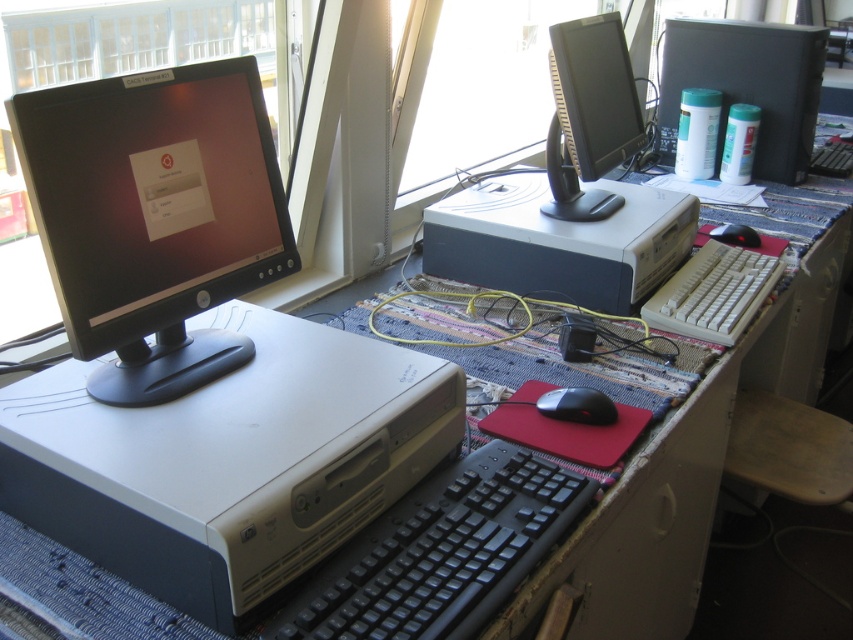
You are organizing cables on the desk and need to know the relative positions of the white plastic computer at upper right and the black rubber mouse at center. Which object is located higher up on the desk?

The white plastic computer at upper right is above the black rubber mouse at center, so it is located higher up on the desk.

You are organizing cables for the black glossy monitor at left located at point (154, 218). Is there enough space between the monitor and the edge of the desk to coil the cables neatly?

The black glossy monitor at left is located at point (154, 218). Since the desk has a patterned surface with blue, white, and red tones, there should be sufficient space between the monitor and the desk edge to coil the cables neatly.

You are a technician who needs to reach the white plastic computer at upper right. You have a 2.0 meter long extension cable. Can you safely extend your cable to reach it?

The white plastic computer at upper right is 2.15 meters away from the camera. Since the extension cable is only 2.0 meters long, it is not long enough to safely reach the computer.